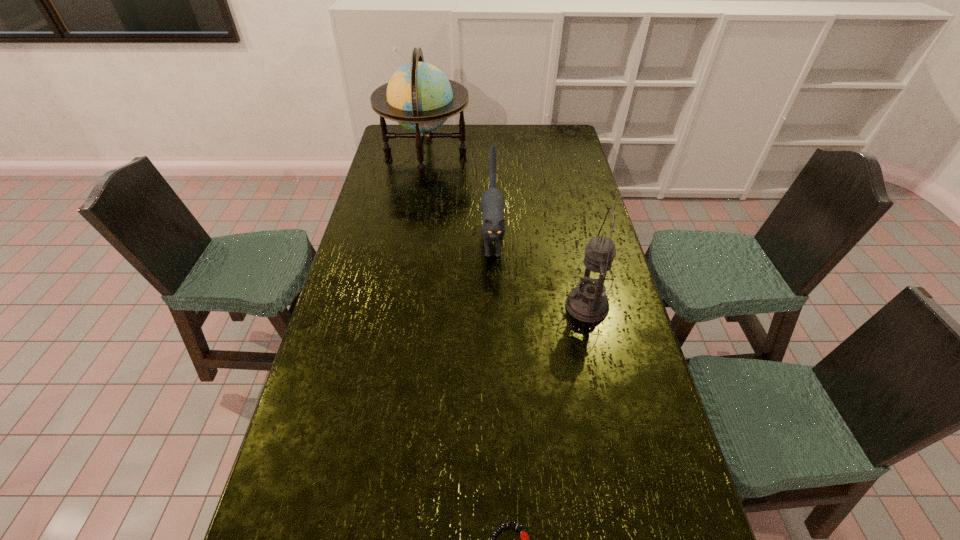
Find the location of `vacant area between the globe and the oil lamp`. vacant area between the globe and the oil lamp is located at coordinates (506, 230).

This screenshot has width=960, height=540. Identify the location of blank region between the third shortest object and the farthest object. (506, 230).

Find the location of a particular element. The image size is (960, 540). the closest object to the rightmost object is located at coordinates pyautogui.click(x=492, y=202).

Select which object is the second closest to the second tallest object. Please provide its 2D coordinates. Your answer should be formatted as a tuple, i.e. [(x, y)], where the tuple contains the x and y coordinates of a point satisfying the conditions above.

[(524, 537)]

The image size is (960, 540). Find the location of `free space that satisfies the following two spatial constraints: 1. at the face of the oil lamp; 2. on the left side of the third tallest object`. free space that satisfies the following two spatial constraints: 1. at the face of the oil lamp; 2. on the left side of the third tallest object is located at coordinates (494, 306).

Where is `vacant region that satisfies the following two spatial constraints: 1. on the surface of the globe; 2. on the back side of the oil lamp`? This screenshot has height=540, width=960. vacant region that satisfies the following two spatial constraints: 1. on the surface of the globe; 2. on the back side of the oil lamp is located at coordinates (399, 306).

Where is `free space in the image that satisfies the following two spatial constraints: 1. at the face of the third shortest object; 2. on the left side of the second shortest object`? This screenshot has height=540, width=960. free space in the image that satisfies the following two spatial constraints: 1. at the face of the third shortest object; 2. on the left side of the second shortest object is located at coordinates (494, 306).

In order to click on vacant space that satisfies the following two spatial constraints: 1. at the face of the cat; 2. on the right side of the oil lamp in this screenshot , I will do `click(494, 306)`.

Identify the location of free space that satisfies the following two spatial constraints: 1. at the face of the rightmost object; 2. on the left side of the third tallest object. (494, 306).